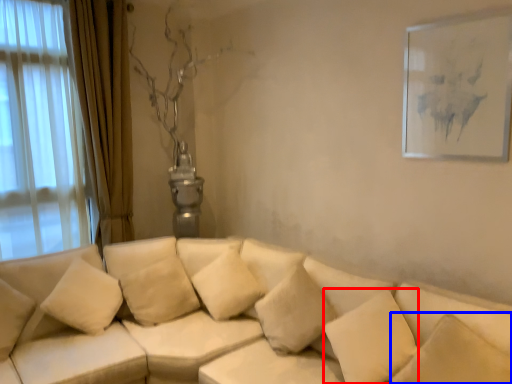
Question: Among these objects, which one is nearest to the camera, pillow (highlighted by a red box) or pillow (highlighted by a blue box)?

Choices:
 (A) pillow
 (B) pillow

Answer: (B)